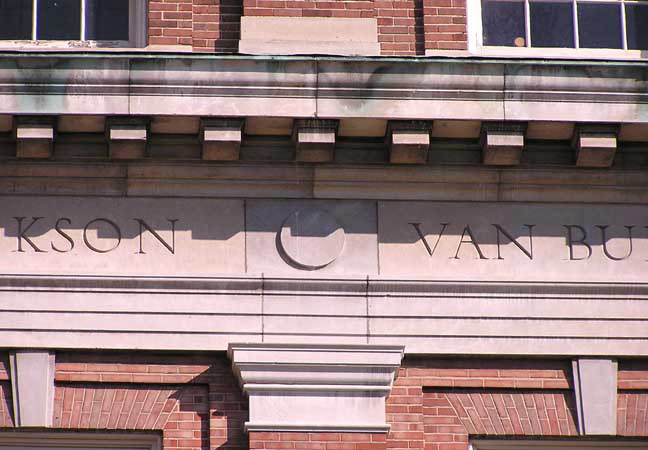
Image resolution: width=648 pixels, height=450 pixels. Find the location of `window`. window is located at coordinates (52, 23).